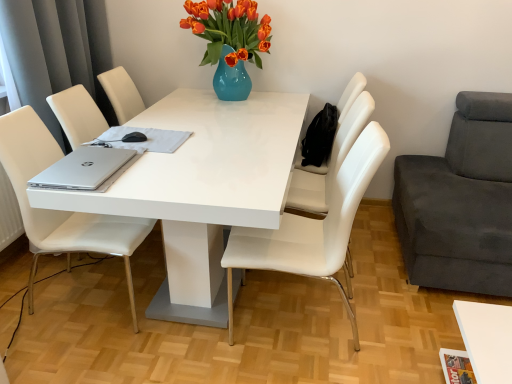
Describe the element at coordinates (144, 139) in the screenshot. The width and height of the screenshot is (512, 384). I see `white cloth at center` at that location.

Where is `white cloth at center`? Image resolution: width=512 pixels, height=384 pixels. white cloth at center is located at coordinates (144, 139).

Describe the element at coordinates (61, 211) in the screenshot. This screenshot has height=384, width=512. I see `white leather chair at left, which is counted as the 4th chair, starting from the right` at that location.

Locate an element on the screen. The image size is (512, 384). white leather chair at center, the 3th chair in the right-to-left sequence is located at coordinates (x=312, y=229).

This screenshot has height=384, width=512. In order to click on white leather chair at center, placed as the 3th chair when sorted from left to right in this screenshot , I will do `click(329, 162)`.

Where is `silver metallic laptop at left`? silver metallic laptop at left is located at coordinates (84, 169).

Is point (137, 244) closer or farther from the camera than point (126, 128)?

Clearly, point (137, 244) is closer to the camera than point (126, 128).

Considering the sizes of objects white leather chair at left, acting as the 1th chair starting from the left, and white cloth at center in the image provided, who is wider, white leather chair at left, acting as the 1th chair starting from the left, or white cloth at center?

Wider between the two is white leather chair at left, acting as the 1th chair starting from the left.

Consider the image. Which is behind, white leather chair at left, which is counted as the 4th chair, starting from the right, or white cloth at center?

Positioned behind is white cloth at center.

From a real-world perspective, who is located lower, dark gray fabric couch at right, the fourth chair in the left-to-right sequence, or white leather chair at center, the 3th chair in the right-to-left sequence?

dark gray fabric couch at right, the fourth chair in the left-to-right sequence, from a real-world perspective.

Between dark gray fabric couch at right, the fourth chair in the left-to-right sequence, and white leather chair at center, the 2th chair in the left-to-right sequence, which one is positioned behind?

Positioned behind is white leather chair at center, the 2th chair in the left-to-right sequence.

Does dark gray fabric couch at right, the fourth chair in the left-to-right sequence, turn towards white leather chair at center, the 2th chair in the left-to-right sequence?

Yes, dark gray fabric couch at right, the fourth chair in the left-to-right sequence, is facing white leather chair at center, the 2th chair in the left-to-right sequence.

Is dark gray fabric couch at right, which is the 1th chair from right to left, taller than white leather chair at center, the 2th chair in the left-to-right sequence?

No.

Is white leather chair at center, placed as the 3th chair when sorted from left to right, to the left of white leather chair at left, acting as the 1th chair starting from the left, from the viewer's perspective?

No.

Is white leather chair at left, acting as the 1th chair starting from the left, surrounded by white leather chair at center, placed as the 2th chair when sorted from right to left?

No, white leather chair at center, placed as the 2th chair when sorted from right to left, does not contain white leather chair at left, acting as the 1th chair starting from the left.

In terms of size, does white leather chair at center, placed as the 2th chair when sorted from right to left, appear bigger or smaller than white leather chair at left, which is counted as the 4th chair, starting from the right?

white leather chair at center, placed as the 2th chair when sorted from right to left, is bigger than white leather chair at left, which is counted as the 4th chair, starting from the right.

Is white leather chair at center, placed as the 2th chair when sorted from right to left, at the back of white glossy table at center?

No, white glossy table at center's orientation is not away from white leather chair at center, placed as the 2th chair when sorted from right to left.

Do you think white glossy table at center is within white leather chair at center, placed as the 3th chair when sorted from left to right, or outside of it?

white glossy table at center is outside white leather chair at center, placed as the 3th chair when sorted from left to right.

Is white glossy table at center positioned far away from white leather chair at center, placed as the 3th chair when sorted from left to right?

No, white glossy table at center is not far away from white leather chair at center, placed as the 3th chair when sorted from left to right.

In the scene shown: Considering the sizes of objects white glossy table at center and white leather chair at center, placed as the 2th chair when sorted from right to left, in the image provided, who is taller, white glossy table at center or white leather chair at center, placed as the 2th chair when sorted from right to left,?

white leather chair at center, placed as the 2th chair when sorted from right to left.

Considering the relative sizes of white leather chair at center, placed as the 3th chair when sorted from left to right, and white leather chair at center, the 3th chair in the right-to-left sequence, in the image provided, is white leather chair at center, placed as the 3th chair when sorted from left to right, smaller than white leather chair at center, the 3th chair in the right-to-left sequence,?

Yes, white leather chair at center, placed as the 3th chair when sorted from left to right, is smaller than white leather chair at center, the 3th chair in the right-to-left sequence.

Which is behind, point (365, 103) or point (305, 247)?

The point (365, 103) is more distant.

Can you confirm if white leather chair at center, placed as the 3th chair when sorted from left to right, is positioned to the left of white leather chair at center, the 3th chair in the right-to-left sequence?

No, white leather chair at center, placed as the 3th chair when sorted from left to right, is not to the left of white leather chair at center, the 3th chair in the right-to-left sequence.

From a real-world perspective, is white cloth at center physically below silver metallic laptop at left?

Yes, from a real-world perspective, white cloth at center is beneath silver metallic laptop at left.

The image size is (512, 384). Identify the location of laptop lying below the white cloth at center (from the image's perspective). click(84, 169).

Considering the positions of objects white cloth at center and silver metallic laptop at left in the image provided, who is more to the left, white cloth at center or silver metallic laptop at left?

silver metallic laptop at left is more to the left.

Is white cloth at center aimed at silver metallic laptop at left?

Yes, white cloth at center is oriented towards silver metallic laptop at left.

Is white leather chair at center, the 3th chair in the right-to-left sequence, inside or outside of dark gray fabric couch at right, which is the 1th chair from right to left?

The correct answer is: outside.

From a real-world perspective, which is physically below, white leather chair at center, the 2th chair in the left-to-right sequence, or dark gray fabric couch at right, which is the 1th chair from right to left?

dark gray fabric couch at right, which is the 1th chair from right to left, from a real-world perspective.

From the image's perspective, which is below, white leather chair at center, the 3th chair in the right-to-left sequence, or dark gray fabric couch at right, which is the 1th chair from right to left?

dark gray fabric couch at right, which is the 1th chair from right to left, from the image's perspective.

Which chair is the 1st one when counting from the front of the white cloth at center? Please provide its 2D coordinates.

[(61, 211)]

Starting from the dark gray fabric couch at right, which is the 1th chair from right to left, which chair is the 1st one behind? Please provide its 2D coordinates.

[(312, 229)]

Looking at the image, which one is located closer to white leather chair at center, placed as the 3th chair when sorted from left to right, white leather chair at center, the 2th chair in the left-to-right sequence, or dark gray fabric couch at right, which is the 1th chair from right to left?

The object closer to white leather chair at center, placed as the 3th chair when sorted from left to right, is white leather chair at center, the 2th chair in the left-to-right sequence.

From the picture: Estimate the real-world distances between objects in this image. Which object is further from dark gray fabric couch at right, the fourth chair in the left-to-right sequence, white leather chair at center, placed as the 2th chair when sorted from right to left, or white leather chair at left, which is counted as the 4th chair, starting from the right?

Based on the image, white leather chair at left, which is counted as the 4th chair, starting from the right, appears to be further to dark gray fabric couch at right, the fourth chair in the left-to-right sequence.

Which object lies nearer to the anchor point white glossy table at center, dark gray fabric couch at right, which is the 1th chair from right to left, or white leather chair at left, acting as the 1th chair starting from the left?

white leather chair at left, acting as the 1th chair starting from the left, is positioned closer to the anchor white glossy table at center.

Estimate the real-world distances between objects in this image. Which object is further from dark gray fabric couch at right, the fourth chair in the left-to-right sequence, silver metallic laptop at left or white leather chair at left, which is counted as the 4th chair, starting from the right?

white leather chair at left, which is counted as the 4th chair, starting from the right, is further to dark gray fabric couch at right, the fourth chair in the left-to-right sequence.

Which object lies further to the anchor point white leather chair at center, placed as the 2th chair when sorted from right to left, white cloth at center or white glossy table at center?

white cloth at center is positioned further to the anchor white leather chair at center, placed as the 2th chair when sorted from right to left.

From the image, which object appears to be nearer to silver metallic laptop at left, white leather chair at center, placed as the 2th chair when sorted from right to left, or dark gray fabric couch at right, the fourth chair in the left-to-right sequence?

The object closer to silver metallic laptop at left is white leather chair at center, placed as the 2th chair when sorted from right to left.

Based on their spatial positions, is white leather chair at center, placed as the 3th chair when sorted from left to right, or white glossy table at center closer to dark gray fabric couch at right, which is the 1th chair from right to left?

Among the two, white leather chair at center, placed as the 3th chair when sorted from left to right, is located nearer to dark gray fabric couch at right, which is the 1th chair from right to left.

From the picture: Considering their positions, is dark gray fabric couch at right, which is the 1th chair from right to left, positioned closer to white leather chair at center, the 2th chair in the left-to-right sequence, than white leather chair at left, which is counted as the 4th chair, starting from the right?

The object closer to white leather chair at center, the 2th chair in the left-to-right sequence, is dark gray fabric couch at right, which is the 1th chair from right to left.

Identify the location of chair between white leather chair at left, which is counted as the 4th chair, starting from the right, and white leather chair at center, placed as the 3th chair when sorted from left to right, from left to right. The width and height of the screenshot is (512, 384). (312, 229).

Find the location of a particular element. laptop between white leather chair at left, which is counted as the 4th chair, starting from the right, and dark gray fabric couch at right, the fourth chair in the left-to-right sequence, in the horizontal direction is located at coordinates (84, 169).

Identify the location of laptop located between white leather chair at left, acting as the 1th chair starting from the left, and white leather chair at center, placed as the 3th chair when sorted from left to right, in the left-right direction. The width and height of the screenshot is (512, 384). (84, 169).

At what (x,y) coordinates should I click in order to perform the action: click on chair situated between silver metallic laptop at left and white leather chair at center, placed as the 3th chair when sorted from left to right, from left to right. Please return your answer as a coordinate pair (x, y). Looking at the image, I should click on (312, 229).